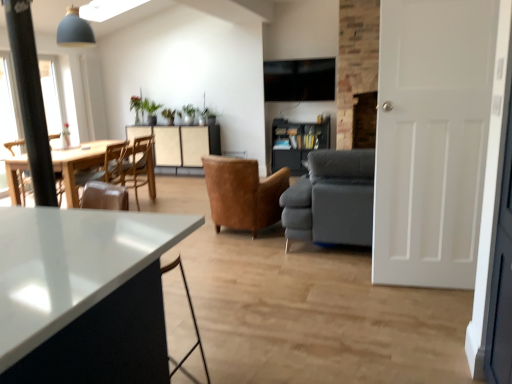
Question: From a real-world perspective, does leather armchair at center, acting as the 1th chair starting from the right, stand above dark gray fabric couch at center?

Choices:
 (A) no
 (B) yes

Answer: (A)

Question: Is leather armchair at center, acting as the 1th chair starting from the right, oriented towards dark gray fabric couch at center?

Choices:
 (A) no
 (B) yes

Answer: (A)

Question: Is leather armchair at center, acting as the 1th chair starting from the right, located outside dark gray fabric couch at center?

Choices:
 (A) yes
 (B) no

Answer: (A)

Question: Is dark gray fabric couch at center surrounded by leather armchair at center, the third chair in the left-to-right sequence?

Choices:
 (A) yes
 (B) no

Answer: (B)

Question: Is leather armchair at center, acting as the 1th chair starting from the right, with dark gray fabric couch at center?

Choices:
 (A) yes
 (B) no

Answer: (B)

Question: Considering the relative positions of leather armchair at center, acting as the 1th chair starting from the right, and dark gray fabric couch at center in the image provided, is leather armchair at center, acting as the 1th chair starting from the right, to the left of dark gray fabric couch at center from the viewer's perspective?

Choices:
 (A) no
 (B) yes

Answer: (B)

Question: Does dark wood bookshelf at center contain beige textured cabinet at center?

Choices:
 (A) no
 (B) yes

Answer: (A)

Question: Is dark wood bookshelf at center located outside beige textured cabinet at center?

Choices:
 (A) no
 (B) yes

Answer: (B)

Question: From the image's perspective, is dark wood bookshelf at center under beige textured cabinet at center?

Choices:
 (A) no
 (B) yes

Answer: (B)

Question: Is dark wood bookshelf at center to the right of beige textured cabinet at center from the viewer's perspective?

Choices:
 (A) yes
 (B) no

Answer: (A)

Question: Considering the relative sizes of dark wood bookshelf at center and beige textured cabinet at center in the image provided, is dark wood bookshelf at center thinner than beige textured cabinet at center?

Choices:
 (A) no
 (B) yes

Answer: (B)

Question: From the image's perspective, is dark wood bookshelf at center on top of beige textured cabinet at center?

Choices:
 (A) no
 (B) yes

Answer: (A)

Question: From a real-world perspective, is wooden chair at left, which ranks as the second chair in right-to-left order, over leather armchair at center, the third chair in the left-to-right sequence?

Choices:
 (A) yes
 (B) no

Answer: (A)